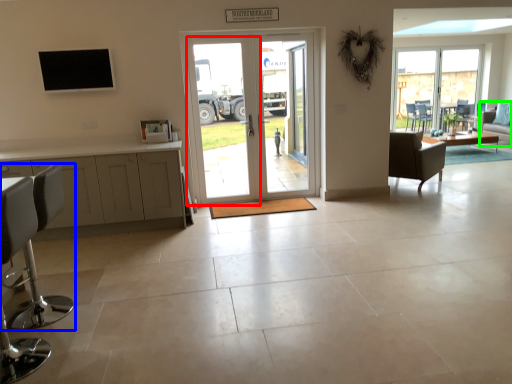
Question: Considering the real-world distances, which object is farthest from screen door (highlighted by a red box)? chair (highlighted by a blue box) or couch (highlighted by a green box)?

Choices:
 (A) chair
 (B) couch

Answer: (B)